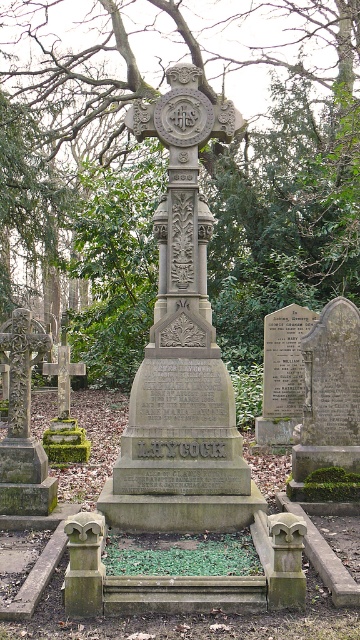
Based on the cemetery scene described, where is the green leafy tree at center in relation to the gray stone cross at center?

The green leafy tree at center is to the left of the gray stone cross at center.

You are standing in a cemetery and see the gray stone cross at center and the green mossy cross at left. Which cross is positioned higher in the image?

The gray stone cross at center is positioned higher than the green mossy cross at left.